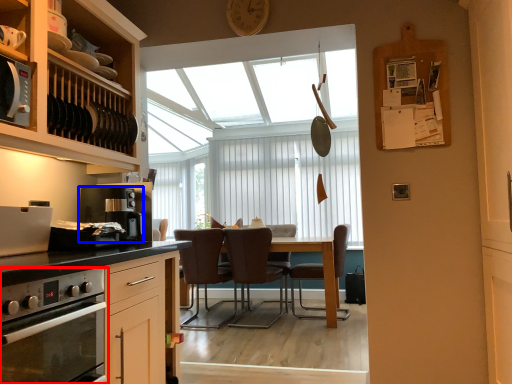
Question: Which object is further to the camera taking this photo, home appliance (highlighted by a red box) or kitchen appliance (highlighted by a blue box)?

Choices:
 (A) home appliance
 (B) kitchen appliance

Answer: (B)